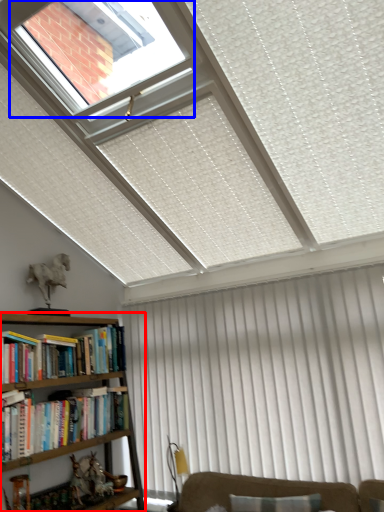
Question: Which of the following is the farthest to the observer, bookcase (highlighted by a red box) or bay window (highlighted by a blue box)?

Choices:
 (A) bookcase
 (B) bay window

Answer: (A)